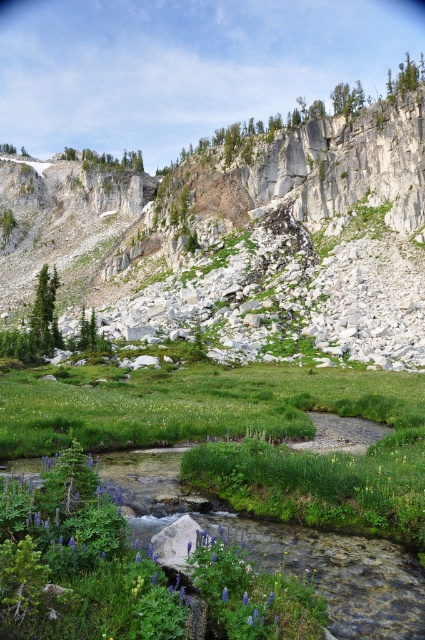
Question: Does white rocky mountain at upper center have a lesser width compared to purple matte flower at center?

Choices:
 (A) yes
 (B) no

Answer: (B)

Question: Where is white rocky mountain at upper center located in relation to purple matte flower at center in the image?

Choices:
 (A) below
 (B) above

Answer: (B)

Question: Among these points, which one is farthest from the camera?

Choices:
 (A) (246, 595)
 (B) (243, 147)

Answer: (B)

Question: Does white rocky mountain at upper center come behind purple matte flower at center?

Choices:
 (A) yes
 (B) no

Answer: (A)

Question: Which of the following is the closest to the observer?

Choices:
 (A) white rocky mountain at upper center
 (B) purple matte flower at center

Answer: (B)